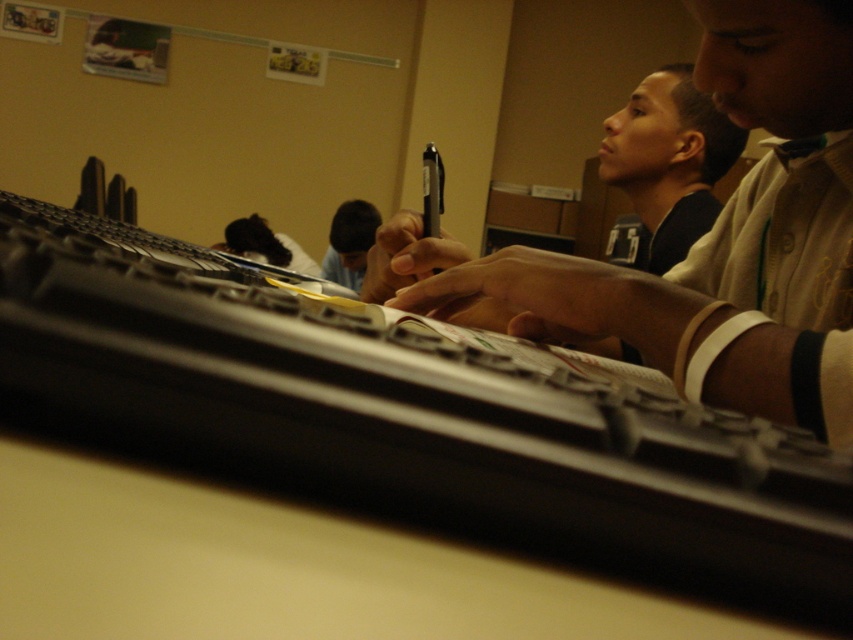
Between point (744, 333) and point (697, 193), which one is positioned in front?

Point (744, 333) is in front.

Does matte black pen at upper center appear on the left side of matte black shirt at upper center?

Correct, you'll find matte black pen at upper center to the left of matte black shirt at upper center.

Is point (845, 97) positioned in front of point (692, 221)?

Yes, point (845, 97) is closer to viewer.

Find the location of a particular element. matte black pen at upper center is located at coordinates (711, 240).

Can you confirm if smooth black hair at center is positioned to the left of dark hair at center?

Incorrect, smooth black hair at center is not on the left side of dark hair at center.

Between smooth black hair at center and dark hair at center, which one is positioned higher?

dark hair at center is higher up.

In order to click on smooth black hair at center in this screenshot , I will do `click(349, 243)`.

Between black plastic keyboard at center and matte black shirt at upper center, which one is positioned lower?

black plastic keyboard at center

Does point (799, 531) come in front of point (633, 131)?

Yes.

Identify the location of black plastic keyboard at center. (408, 417).